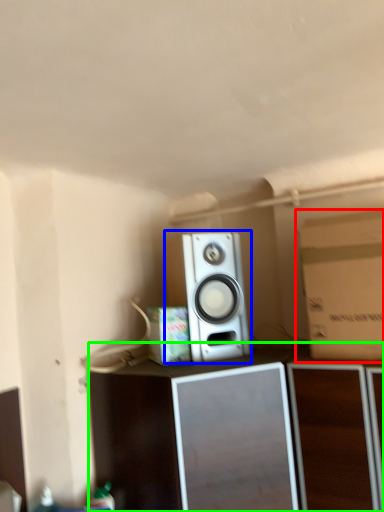
Question: Estimate the real-world distances between objects in this image. Which object is farther from cardboard box (highlighted by a red box), home appliance (highlighted by a blue box) or furniture (highlighted by a green box)?

Choices:
 (A) home appliance
 (B) furniture

Answer: (A)